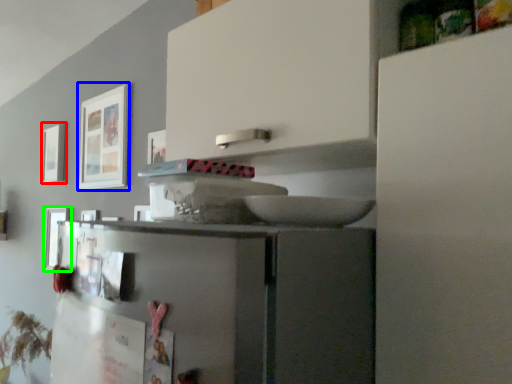
Question: Which object is positioned closest to picture frame (highlighted by a red box)? Select from picture frame (highlighted by a blue box) and picture frame (highlighted by a green box).

Choices:
 (A) picture frame
 (B) picture frame

Answer: (B)